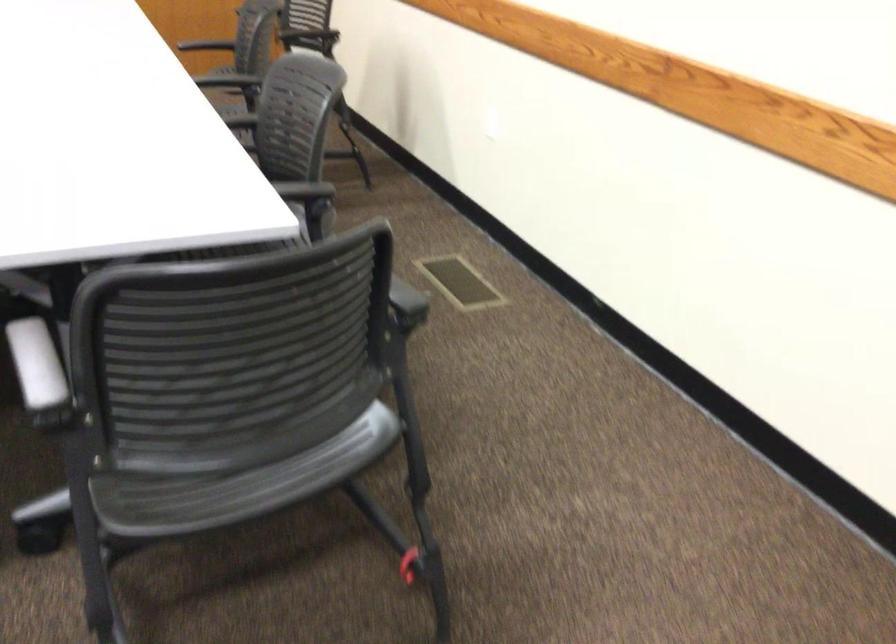
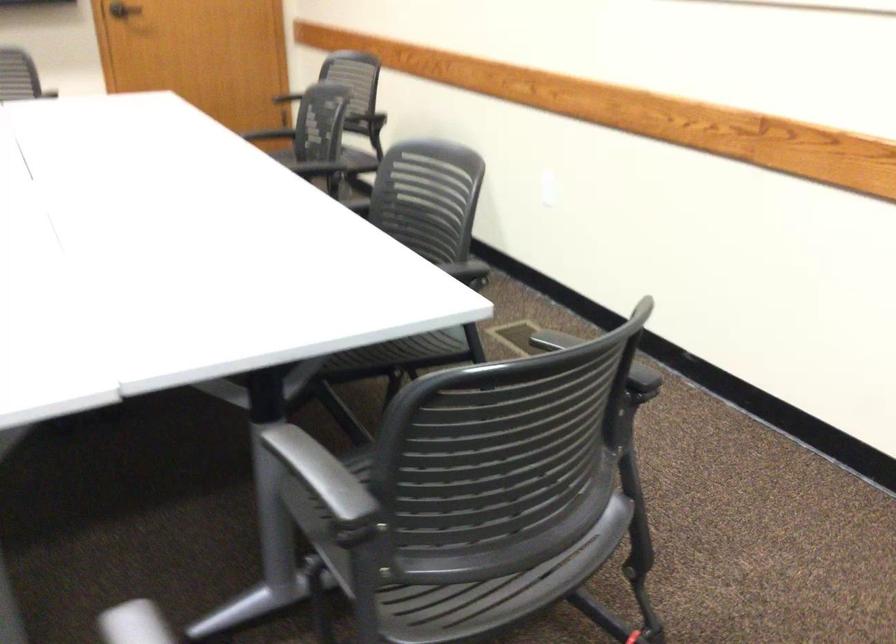
Find the pixel in the second image that matches [492,131] in the first image.

(547, 196)